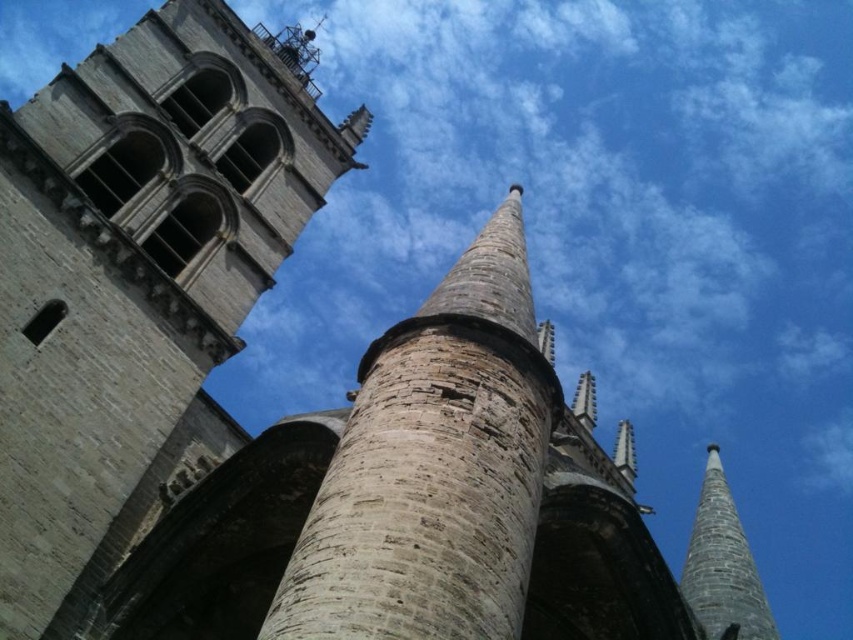
Between point (15, 323) and point (502, 577), which one is positioned behind?

Point (15, 323)

Is stone tower at center bigger than stone textured pillar at center?

Yes, stone tower at center is bigger than stone textured pillar at center.

Which is in front, point (48, 179) or point (321, 497)?

Point (321, 497) is in front.

This screenshot has height=640, width=853. I want to click on stone tower at center, so click(137, 280).

Can you confirm if stone tower at center is positioned to the left of smooth gray stone spire at right?

Yes, stone tower at center is to the left of smooth gray stone spire at right.

At what (x,y) coordinates should I click in order to perform the action: click on stone tower at center. Please return your answer as a coordinate pair (x, y). This screenshot has height=640, width=853. Looking at the image, I should click on (137, 280).

Is point (460, 372) behind point (712, 608)?

No, it is not.

Can you confirm if stone textured pillar at center is positioned to the left of smooth gray stone spire at right?

Correct, you'll find stone textured pillar at center to the left of smooth gray stone spire at right.

Does point (393, 508) come behind point (727, 589)?

No, it is not.

The height and width of the screenshot is (640, 853). In order to click on stone textured pillar at center in this screenshot , I will do `click(433, 467)`.